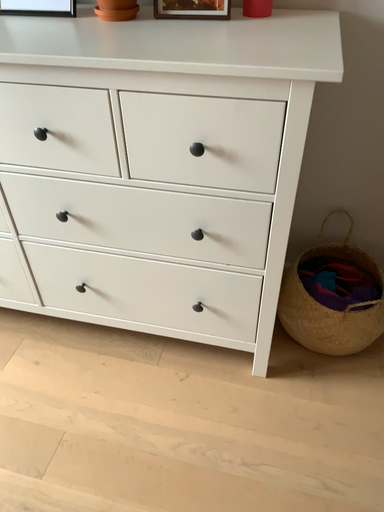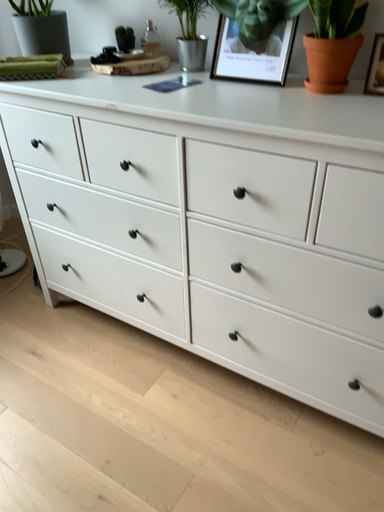
Question: Which way did the camera rotate in the video?

Choices:
 (A) rotated left
 (B) rotated right

Answer: (A)